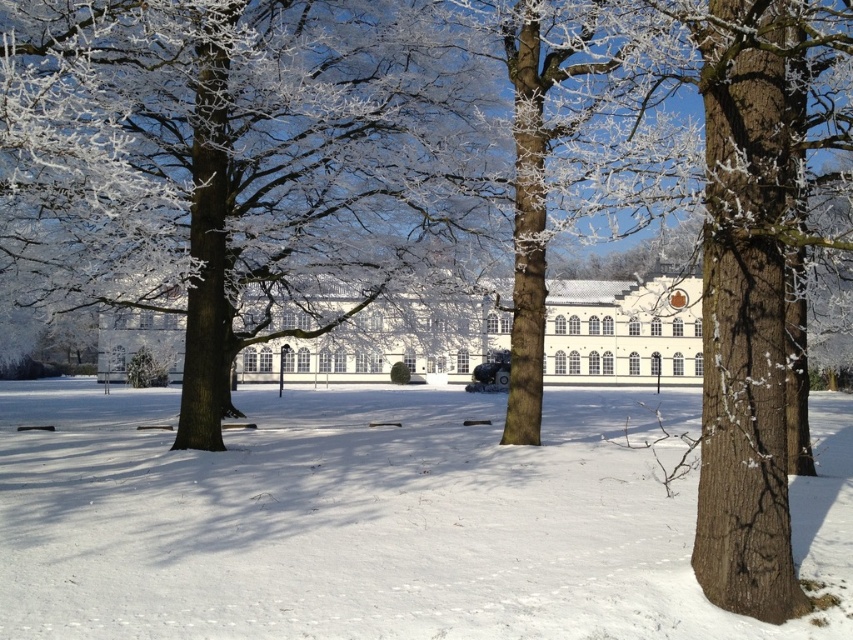
You are an architect designing a new pathway between the smooth brown tree trunk at center and the white smooth building at center. Considering their widths, which object requires more space to accommodate on either side of the pathway?

The white smooth building at center requires more space because its width is greater than the smooth brown tree trunk at center.

You are standing in the winter scene and want to walk to the building. Which object, the white powdery snow at center or the smooth brown tree trunk at center, would you encounter first?

The white powdery snow at center is in front of the smooth brown tree trunk at center, so you would encounter the white powdery snow at center first when walking towards the building.

In the scene shown: You are standing at the point marked by point (376, 520) in the image. Based on the scene description, what is the most likely surface or object you are standing on?

The point (376, 520) corresponds to the white powdery snow at center, so you are standing on the snow.